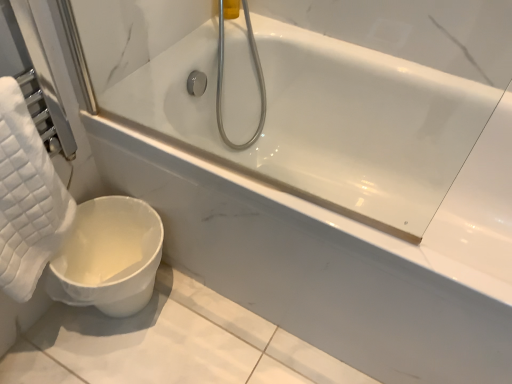
The image size is (512, 384). What do you see at coordinates (27, 198) in the screenshot?
I see `white textured towel at left` at bounding box center [27, 198].

The width and height of the screenshot is (512, 384). I want to click on white textured towel at left, so click(27, 198).

Identify the location of white textured towel at left. (27, 198).